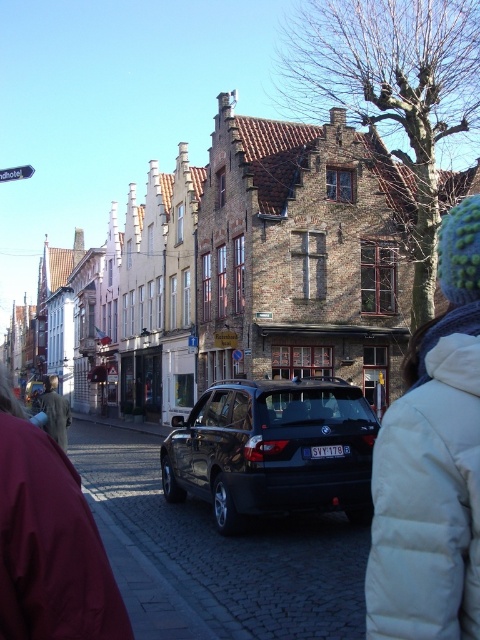
You are a tourist standing on the cobblestone street and see both the maroon fabric jacket at lower left and the light brown leather jacket at lower left. Which jacket is positioned more to the right?

The maroon fabric jacket at lower left is positioned to the right of the light brown leather jacket at lower left, so the maroon fabric jacket at lower left is more to the right.